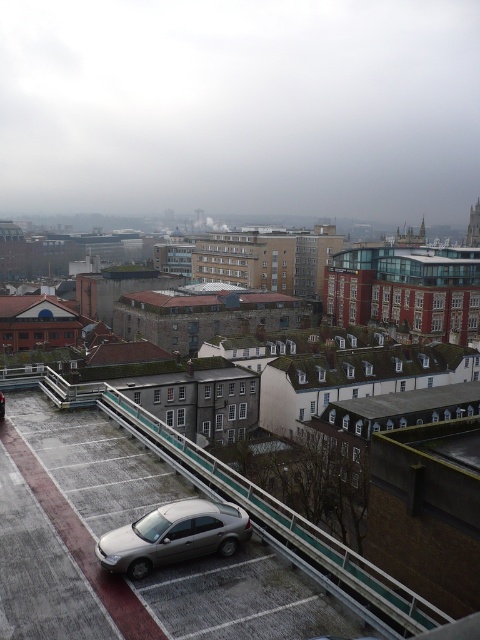
You are standing at the point with coordinates [243,600] on this rooftop parking lot. Which object are you directly above?

The point [243,600] corresponds to the metallic silver car at lower left, so you are directly above the metallic silver car at lower left.

You are a delivery person trying to park your vehicle in the parking area of the rooftop. You see a metallic silver car at lower left and a satin silver sedan at lower center. Which vehicle should you avoid if you want to park in a space that can accommodate larger vehicles?

You should avoid the satin silver sedan at lower center because the metallic silver car at lower left is bigger and would require a larger parking space.